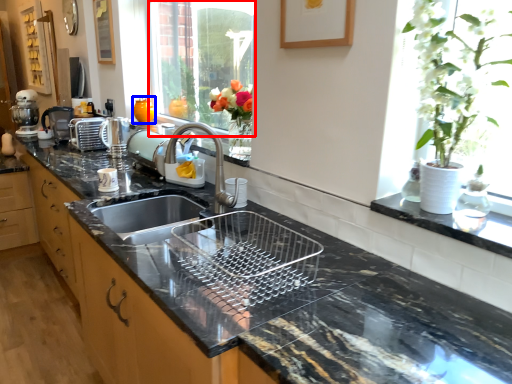
Question: Which of the following is the farthest to the observer, window (highlighted by a red box) or vase (highlighted by a blue box)?

Choices:
 (A) window
 (B) vase

Answer: (B)